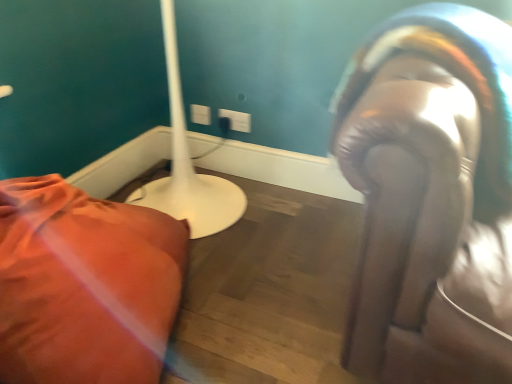
Question: From a real-world perspective, is white plastic electric outlet at upper center, which appears as the 1th electric outlet when viewed from the right, positioned above or below matte white lamp at left?

Choices:
 (A) below
 (B) above

Answer: (B)

Question: From their relative heights in the image, would you say white plastic electric outlet at upper center, marked as the second electric outlet in a left-to-right arrangement, is taller or shorter than matte white lamp at left?

Choices:
 (A) short
 (B) tall

Answer: (A)

Question: Which is nearer to the white plastic electric outlet at upper center, which appears as the 2th electric outlet when viewed from the right?

Choices:
 (A) leather-like glove at right
 (B) white plastic electric outlet at upper center, which appears as the 1th electric outlet when viewed from the right
 (C) matte white lamp at left

Answer: (B)

Question: Which of these objects is positioned farthest from the white plastic electric outlet at upper center, which appears as the 2th electric outlet when viewed from the right?

Choices:
 (A) matte white lamp at left
 (B) leather-like glove at right
 (C) white plastic electric outlet at upper center, which appears as the 1th electric outlet when viewed from the right

Answer: (B)